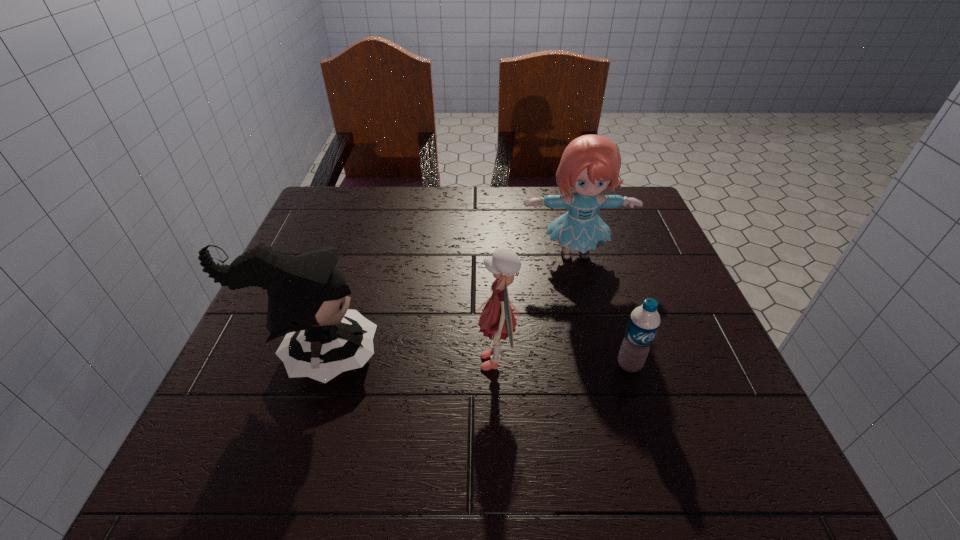
At what (x,y) coordinates should I click in order to perform the action: click on vacant space located on the label of the shortest object. Please return your answer as a coordinate pair (x, y). Looking at the image, I should click on (665, 481).

You are a GUI agent. You are given a task and a screenshot of the screen. Output one action in this format:
    pyautogui.click(x=<x>, y=<y>)
    Task: Click on the object at the left edge
    
    Given the screenshot: What is the action you would take?
    pyautogui.click(x=307, y=295)

Locate an element on the screen. Image resolution: width=960 pixels, height=540 pixels. doll located in the right edge section of the desktop is located at coordinates (590, 163).

Image resolution: width=960 pixels, height=540 pixels. In order to click on water bottle at the right edge in this screenshot , I will do `click(644, 321)`.

The width and height of the screenshot is (960, 540). In the image, there is a desktop. In order to click on vacant space at the far edge in this screenshot , I will do `click(394, 193)`.

Locate an element on the screen. The width and height of the screenshot is (960, 540). blank space at the right edge of the desktop is located at coordinates (711, 349).

Find the location of a particular element. The height and width of the screenshot is (540, 960). vacant area at the far left corner of the desktop is located at coordinates (319, 205).

In the image, there is a desktop. At what (x,y) coordinates should I click in order to perform the action: click on vacant space at the near left corner. Please return your answer as a coordinate pair (x, y). Looking at the image, I should click on (234, 446).

In the image, there is a desktop. Where is `vacant area at the far right corner`? vacant area at the far right corner is located at coordinates (612, 214).

Where is `free area in between the shortest object and the leftmost object`? free area in between the shortest object and the leftmost object is located at coordinates (472, 360).